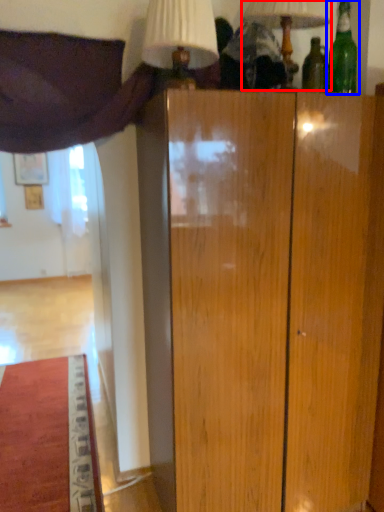
Question: Among these objects, which one is nearest to the camera, table lamp (highlighted by a red box) or bottle (highlighted by a blue box)?

Choices:
 (A) table lamp
 (B) bottle

Answer: (A)